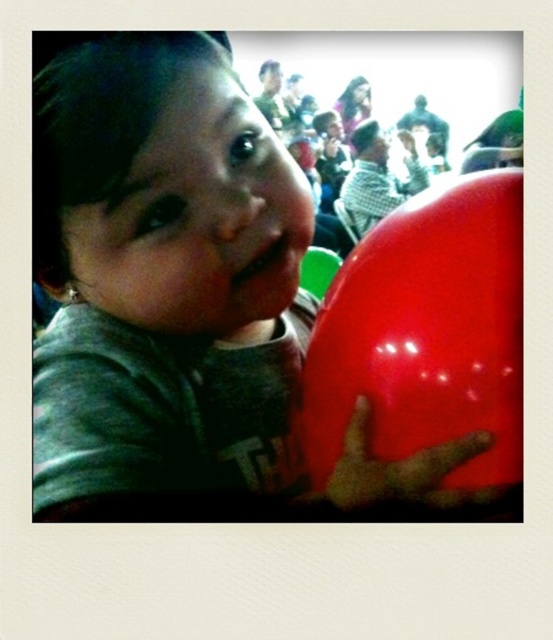
Between matte plastic balloon at center and rubber glove at right, which one has less height?

rubber glove at right

Consider the image. Is matte plastic balloon at center taller than rubber glove at right?

Yes, matte plastic balloon at center is taller than rubber glove at right.

Looking at this image, measure the distance between point (91, 152) and camera.

Point (91, 152) and camera are 14.74 inches apart.

Identify the location of matte plastic balloon at center. The image size is (553, 640). (179, 291).

Who is positioned more to the right, matte plastic balloon at center or glossy red balloon at right?

Positioned to the right is glossy red balloon at right.

Is matte plastic balloon at center shorter than glossy red balloon at right?

In fact, matte plastic balloon at center may be taller than glossy red balloon at right.

At what (x,y) coordinates should I click in order to perform the action: click on matte plastic balloon at center. Please return your answer as a coordinate pair (x, y). The image size is (553, 640). Looking at the image, I should click on (179, 291).

Which is more to the right, glossy red balloon at right or rubber glove at right?

glossy red balloon at right is more to the right.

Is glossy red balloon at right positioned in front of rubber glove at right?

No, glossy red balloon at right is behind rubber glove at right.

Find the location of a particular element. The height and width of the screenshot is (640, 553). glossy red balloon at right is located at coordinates (425, 333).